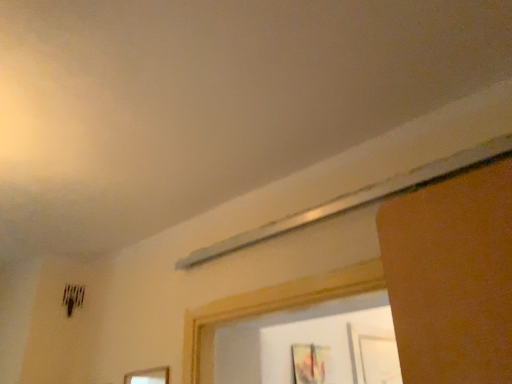
Question: Is wooden picture frame at lower center, arranged as the 2th picture frame when viewed from the back, positioned far away from matte wooden picture frame at lower right, the second picture frame from the left?

Choices:
 (A) no
 (B) yes

Answer: (A)

Question: Is wooden picture frame at lower center, which is the second picture frame in right-to-left order, bigger than matte wooden picture frame at lower right, the second picture frame from the left?

Choices:
 (A) yes
 (B) no

Answer: (B)

Question: Is wooden picture frame at lower center, the 1th picture frame viewed from the left, taller than matte wooden picture frame at lower right, the second picture frame from the left?

Choices:
 (A) yes
 (B) no

Answer: (B)

Question: Is wooden picture frame at lower center, which is the second picture frame in right-to-left order, next to matte wooden picture frame at lower right, the second picture frame from the left?

Choices:
 (A) no
 (B) yes

Answer: (A)

Question: Does wooden picture frame at lower center, the 1th picture frame in the front-to-back sequence, lie behind matte wooden picture frame at lower right, placed as the second picture frame when sorted from front to back?

Choices:
 (A) yes
 (B) no

Answer: (B)

Question: From the image's perspective, is wooden picture frame at lower center, which is the second picture frame in right-to-left order, above matte wooden picture frame at lower right, which is counted as the first picture frame, starting from the back?

Choices:
 (A) yes
 (B) no

Answer: (A)

Question: Does matte wooden picture frame at lower right, acting as the 1th picture frame starting from the right, come behind wooden picture frame at lower center, arranged as the 2th picture frame when viewed from the back?

Choices:
 (A) no
 (B) yes

Answer: (B)

Question: Is matte wooden picture frame at lower right, placed as the second picture frame when sorted from front to back, positioned beyond the bounds of wooden picture frame at lower center, the 1th picture frame in the front-to-back sequence?

Choices:
 (A) yes
 (B) no

Answer: (A)

Question: Does matte wooden picture frame at lower right, the second picture frame from the left, have a lesser width compared to wooden picture frame at lower center, the 1th picture frame viewed from the left?

Choices:
 (A) no
 (B) yes

Answer: (A)

Question: From a real-world perspective, is matte wooden picture frame at lower right, which is counted as the first picture frame, starting from the back, on wooden picture frame at lower center, the 1th picture frame in the front-to-back sequence?

Choices:
 (A) no
 (B) yes

Answer: (B)

Question: Considering the relative positions of matte wooden picture frame at lower right, acting as the 1th picture frame starting from the right, and wooden picture frame at lower center, the 1th picture frame viewed from the left, in the image provided, is matte wooden picture frame at lower right, acting as the 1th picture frame starting from the right, to the right of wooden picture frame at lower center, the 1th picture frame viewed from the left, from the viewer's perspective?

Choices:
 (A) no
 (B) yes

Answer: (B)

Question: From the image's perspective, is matte wooden picture frame at lower right, the second picture frame from the left, below wooden picture frame at lower center, the 1th picture frame viewed from the left?

Choices:
 (A) yes
 (B) no

Answer: (A)

Question: Is wooden picture frame at lower center, arranged as the 2th picture frame when viewed from the back, bigger or smaller than matte wooden picture frame at lower right, acting as the 1th picture frame starting from the right?

Choices:
 (A) small
 (B) big

Answer: (A)